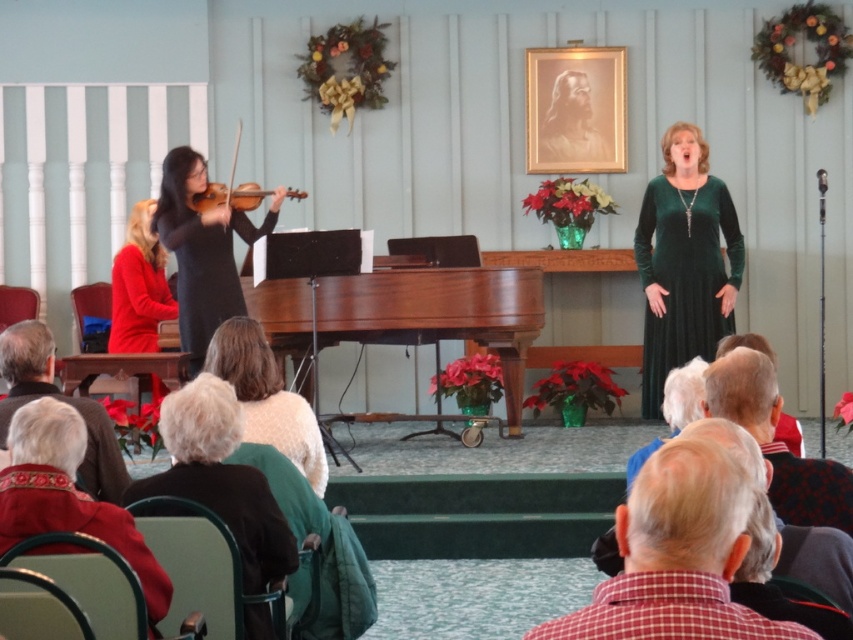
Which is more to the left, dark green sweater at lower center or black matte violin at left?

Positioned to the left is black matte violin at left.

Is point (196, 408) farther from camera compared to point (180, 211)?

That is False.

Which is behind, point (247, 488) or point (175, 218)?

The point (175, 218) is more distant.

Where is `dark green sweater at lower center`? This screenshot has width=853, height=640. dark green sweater at lower center is located at coordinates (221, 480).

Who is positioned more to the right, dark green sweater at lower center or matte red dress at left?

dark green sweater at lower center

Is point (293, 540) in front of point (131, 269)?

Yes, point (293, 540) is in front of point (131, 269).

Where is `dark green sweater at lower center`? dark green sweater at lower center is located at coordinates (221, 480).

Who is taller, black matte violin at left or matte red dress at left?

With more height is matte red dress at left.

Is point (198, 179) positioned in front of point (112, 340)?

Yes, it is in front of point (112, 340).

The image size is (853, 640). In order to click on black matte violin at left in this screenshot , I will do `click(202, 250)`.